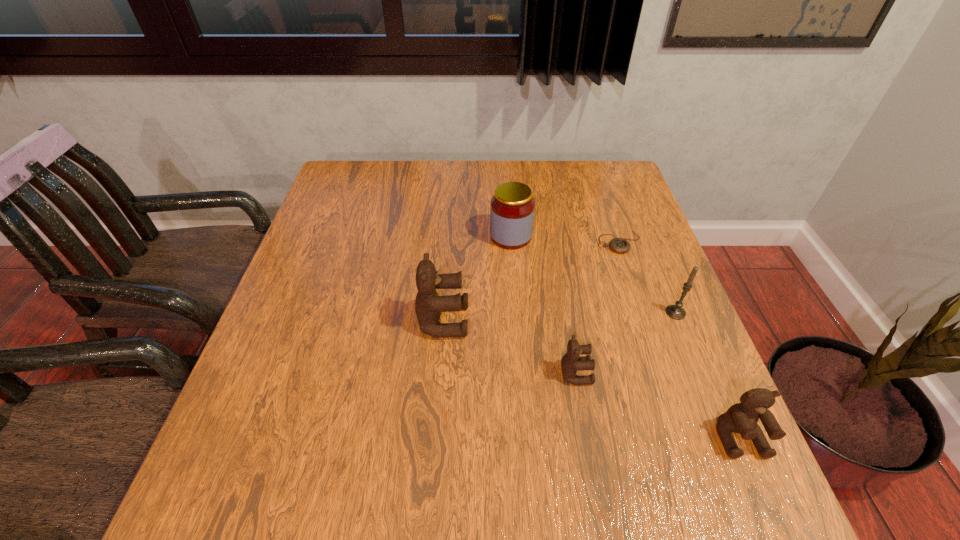
Find the location of a particular element. The image size is (960, 540). vacant space at the near edge of the desktop is located at coordinates (341, 414).

In the image, there is a desktop. Where is `free space at the left edge`? This screenshot has width=960, height=540. free space at the left edge is located at coordinates (366, 232).

At what (x,y) coordinates should I click in order to perform the action: click on free space at the right edge of the desktop. Please return your answer as a coordinate pair (x, y). The height and width of the screenshot is (540, 960). Looking at the image, I should click on tap(622, 207).

The height and width of the screenshot is (540, 960). I want to click on free space at the far left corner of the desktop, so click(365, 185).

The height and width of the screenshot is (540, 960). Find the location of `free space between the candle and the leftmost object`. free space between the candle and the leftmost object is located at coordinates (x=560, y=316).

Locate an element on the screen. This screenshot has width=960, height=540. empty space between the pocket watch and the candle is located at coordinates (647, 278).

Where is `empty space that is in between the third shortest object and the second teddy bear from left to right`? Image resolution: width=960 pixels, height=540 pixels. empty space that is in between the third shortest object and the second teddy bear from left to right is located at coordinates (658, 406).

You are a GUI agent. You are given a task and a screenshot of the screen. Output one action in this format:
    pyautogui.click(x=<x>, y=<y>)
    Task: Click on the vacant point located between the pocket watch and the nearest object
    This screenshot has width=960, height=540.
    Given the screenshot: What is the action you would take?
    pyautogui.click(x=680, y=340)

You are a GUI agent. You are given a task and a screenshot of the screen. Output one action in this format:
    pyautogui.click(x=<x>, y=<y>)
    Task: Click on the free space between the candle and the jar
    This screenshot has width=960, height=540.
    Given the screenshot: What is the action you would take?
    pyautogui.click(x=593, y=274)

This screenshot has width=960, height=540. Identify the location of vacant space that is in between the shortest object and the second tallest teddy bear. (680, 340).